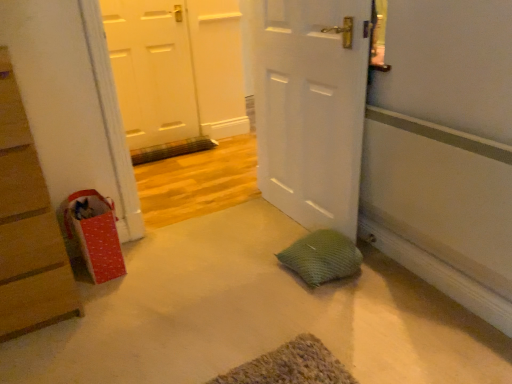
Locate an element on the screen. Image resolution: width=512 pixels, height=384 pixels. free area in between white matte door at center, which appears as the 2th door when viewed from the left, and red cardboard chest of drawers at left is located at coordinates (192, 261).